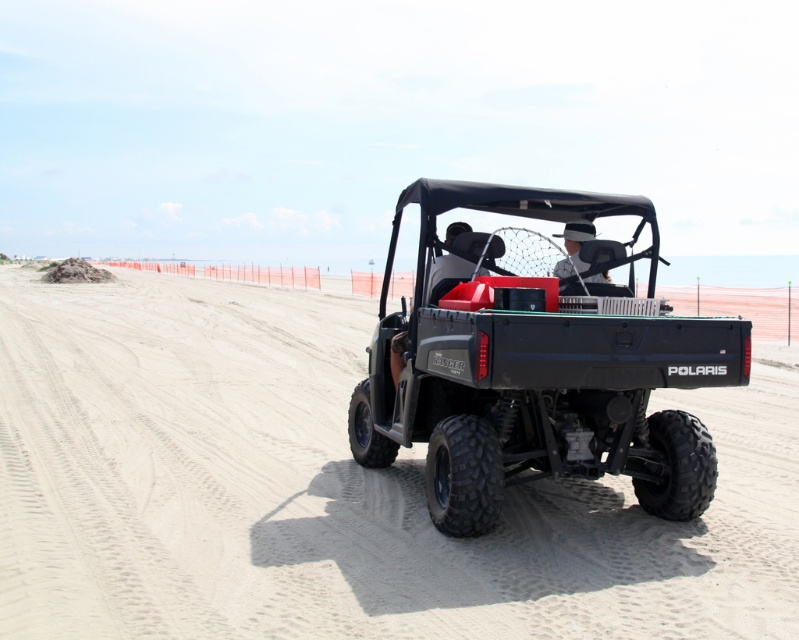
Based on the photo, you are standing on the beach and want to place the white fabric hat at center on top of the sandy dirt track at center. Is this possible based on their heights?

The sandy dirt track at center has a greater height compared to white fabric hat at center, so yes, the white fabric hat at center can be placed on top of the sandy dirt track at center since it is shorter.